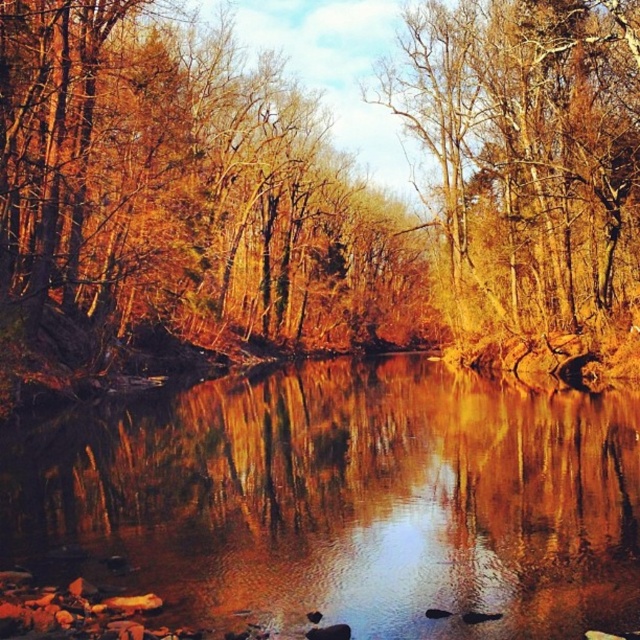
You are a GUI agent. You are given a task and a screenshot of the screen. Output one action in this format:
    pyautogui.click(x=<x>, y=<y>)
    Task: Click on the shiny reflective water at center
    
    Given the screenshot: What is the action you would take?
    pyautogui.click(x=342, y=500)

Does shiny reflective water at center appear over golden textured tree at upper center?

No.

Does point (99, 541) come farther from viewer compared to point (465, 138)?

No, (99, 541) is in front of (465, 138).

The height and width of the screenshot is (640, 640). Identify the location of shiny reflective water at center. (342, 500).